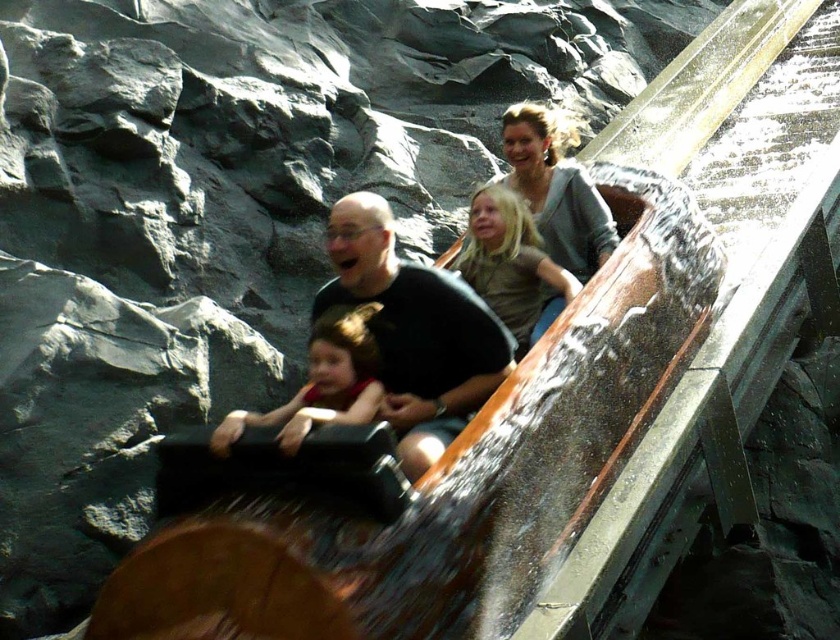
Question: Can you confirm if matte gray sweater at upper center is positioned below matte red shirt at center?

Choices:
 (A) yes
 (B) no

Answer: (B)

Question: Is matte gray sweater at upper center positioned before matte gray shirt at center?

Choices:
 (A) no
 (B) yes

Answer: (A)

Question: Among these objects, which one is farthest from the camera?

Choices:
 (A) matte gray shirt at center
 (B) matte gray sweater at upper center
 (C) matte red shirt at center
 (D) black matte shirt at center

Answer: (B)

Question: Does black matte shirt at center appear on the left side of matte gray sweater at upper center?

Choices:
 (A) yes
 (B) no

Answer: (A)

Question: Which point appears farthest from the camera in this image?

Choices:
 (A) (350, 268)
 (B) (300, 401)
 (C) (567, 220)

Answer: (C)

Question: Which object appears farthest from the camera in this image?

Choices:
 (A) matte gray shirt at center
 (B) matte gray sweater at upper center
 (C) matte red shirt at center
 (D) black matte shirt at center

Answer: (B)